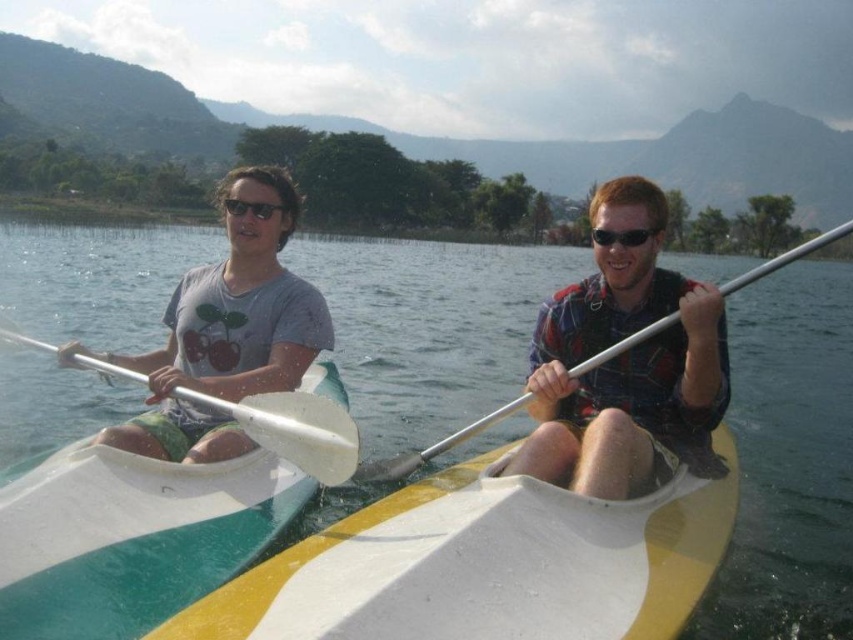
You are a photographer trying to capture both the matte plaid shirt at center and the white plastic paddle at center in a single shot. Given their sizes, which object should you focus on to ensure both are clearly visible in the frame?

The matte plaid shirt at center has a smaller size compared to the white plastic paddle at center. To ensure both are clearly visible, focus on the smaller object, the matte plaid shirt at center, as it requires more attention to detail due to its size relative to the paddle.

You are planning to place a buoy between the two points, point (265,540) and point (608,348). Based on their positions, which point is closer to you so that you can decide where to place the buoy closer to the viewer?

Point (265,540) is closer to the viewer than point (608,348), so you should place the buoy closer to point (265,540) to ensure it is nearer to your position.

You are a photographer trying to capture a shot of the white glossy kayak at left and the white plastic paddle at center. Since both are white, you want to ensure you can distinguish them in your photo. Based on their positions, which object should you focus on first to ensure the kayak is in the frame?

The white glossy kayak at left is to the left of the white plastic paddle at center, so you should focus on the white glossy kayak at left first to ensure it is in the frame before adjusting for the paddle.